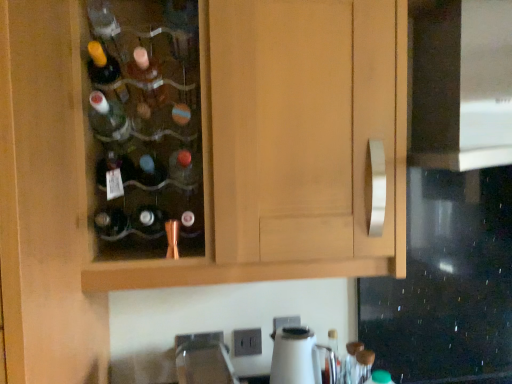
Question: Does black glass oven at right have a greater height compared to matte glass bottle at center?

Choices:
 (A) no
 (B) yes

Answer: (B)

Question: Is black glass oven at right not inside matte glass bottle at center?

Choices:
 (A) no
 (B) yes

Answer: (B)

Question: Is matte glass bottle at center located within black glass oven at right?

Choices:
 (A) no
 (B) yes

Answer: (A)

Question: Does black glass oven at right turn towards matte glass bottle at center?

Choices:
 (A) yes
 (B) no

Answer: (B)

Question: Considering the relative positions of black glass oven at right and matte glass bottle at center in the image provided, is black glass oven at right in front of matte glass bottle at center?

Choices:
 (A) yes
 (B) no

Answer: (A)

Question: From the image's perspective, is black glass oven at right above or below white glossy kettle at lower center?

Choices:
 (A) below
 (B) above

Answer: (B)

Question: In terms of size, does black glass oven at right appear bigger or smaller than white glossy kettle at lower center?

Choices:
 (A) small
 (B) big

Answer: (B)

Question: From a real-world perspective, is black glass oven at right above or below white glossy kettle at lower center?

Choices:
 (A) below
 (B) above

Answer: (B)

Question: Relative to white glossy kettle at lower center, is black glass oven at right in front or behind?

Choices:
 (A) behind
 (B) front

Answer: (B)

Question: Looking at the image, does black glass oven at right seem bigger or smaller compared to satin nickel faucet at lower center?

Choices:
 (A) big
 (B) small

Answer: (A)

Question: From the image's perspective, is black glass oven at right above or below satin nickel faucet at lower center?

Choices:
 (A) below
 (B) above

Answer: (B)

Question: Is black glass oven at right spatially inside satin nickel faucet at lower center, or outside of it?

Choices:
 (A) outside
 (B) inside

Answer: (A)

Question: In the image, is black glass oven at right positioned in front of or behind satin nickel faucet at lower center?

Choices:
 (A) behind
 (B) front

Answer: (B)

Question: Looking at their shapes, would you say wooden cabinet at center is wider or thinner than white glossy kettle at lower center?

Choices:
 (A) wide
 (B) thin

Answer: (A)

Question: In the image, is wooden cabinet at center positioned in front of or behind white glossy kettle at lower center?

Choices:
 (A) front
 (B) behind

Answer: (A)